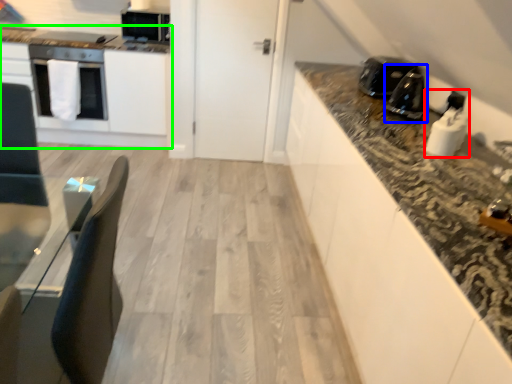
Question: Which is nearer to the appliance (highlighted by a red box)? appliance (highlighted by a blue box) or cabinetry (highlighted by a green box).

Choices:
 (A) appliance
 (B) cabinetry

Answer: (A)